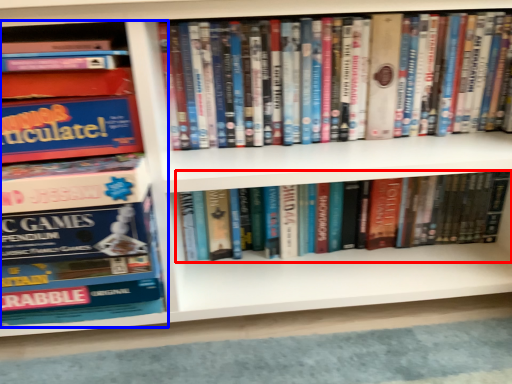
Question: Which of the following is the farthest to the observer, book (highlighted by a red box) or book (highlighted by a blue box)?

Choices:
 (A) book
 (B) book

Answer: (A)